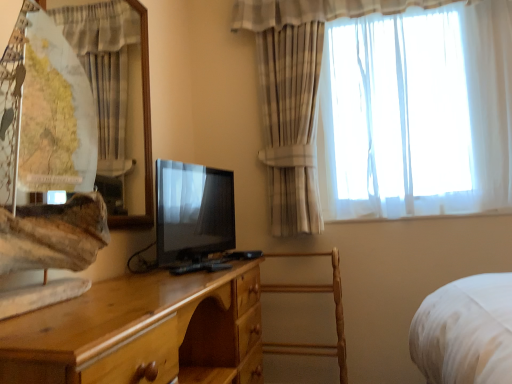
Question: In the image, is sheer white curtain at upper right, the second curtain from the left, positioned in front of or behind matte black tv at center?

Choices:
 (A) front
 (B) behind

Answer: (B)

Question: From a real-world perspective, relative to matte black tv at center, is sheer white curtain at upper right, the 2th curtain positioned from the front, vertically above or below?

Choices:
 (A) above
 (B) below

Answer: (A)

Question: Which is farther from the white sheer curtain at upper left, which ranks as the second curtain in right-to-left order?

Choices:
 (A) light brown wood chest of drawers at center
 (B) wooden armchair at center
 (C) sheer white curtain at upper right, the 2th curtain positioned from the front
 (D) matte black tv at center

Answer: (B)

Question: Which object is positioned farthest from the sheer white curtain at upper right, the second curtain from the left?

Choices:
 (A) white sheer curtain at upper left, which is the 1th curtain in front-to-back order
 (B) wooden armchair at center
 (C) light brown wood chest of drawers at center
 (D) matte black tv at center

Answer: (C)